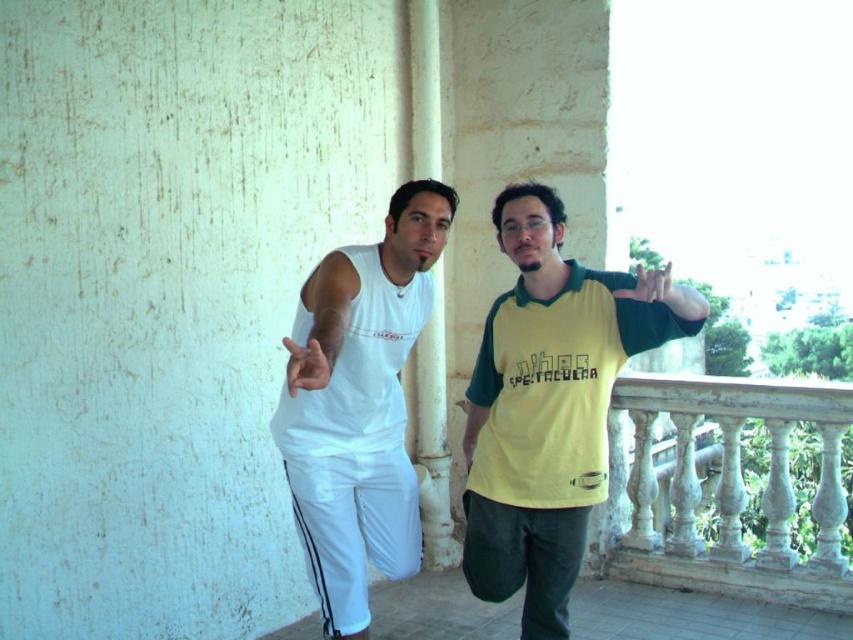
Which of these two, yellow-green jersey at right or white matte tank top at center, stands taller?

With more height is yellow-green jersey at right.

Can you confirm if yellow-green jersey at right is bigger than white matte tank top at center?

Correct, yellow-green jersey at right is larger in size than white matte tank top at center.

Between point (519, 260) and point (383, 445), which one is positioned in front?

Point (383, 445) is in front.

I want to click on yellow-green jersey at right, so click(x=547, y=408).

Who is more distant from viewer, (335, 339) or (642, 285)?

The point (642, 285) is behind.

Can you confirm if matte white hand at center is bigger than yellow-green fabric hand at upper right?

Incorrect, matte white hand at center is not larger than yellow-green fabric hand at upper right.

The height and width of the screenshot is (640, 853). I want to click on matte white hand at center, so click(x=310, y=362).

Measure the distance between white matte tank top at center and camera.

The distance of white matte tank top at center from camera is 4.62 meters.

Can you confirm if white matte tank top at center is taller than white stone balustrade at lower right?

Yes.

Is point (328, 416) closer to viewer compared to point (659, 557)?

Yes, it is in front of point (659, 557).

This screenshot has height=640, width=853. Find the location of `white matte tank top at center`. white matte tank top at center is located at coordinates (361, 406).